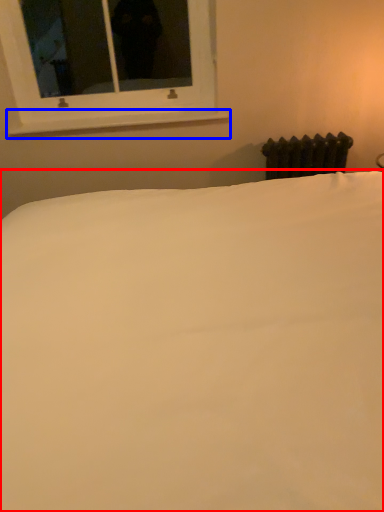
Question: Which of the following is the farthest to the observer, bed (highlighted by a red box) or window sill (highlighted by a blue box)?

Choices:
 (A) bed
 (B) window sill

Answer: (B)